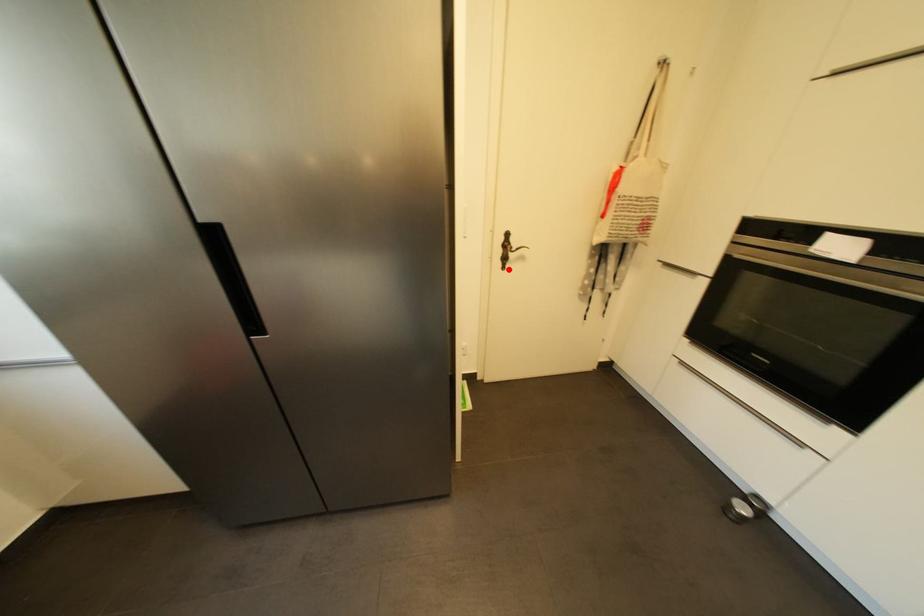
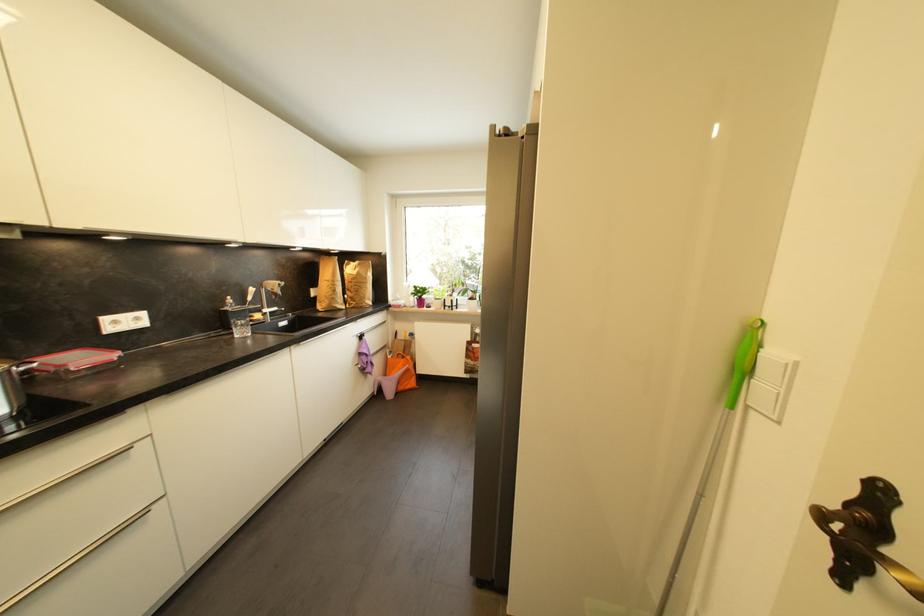
The point at the highlighted location is marked in the first image. Where is the corresponding point in the second image?

(846, 581)